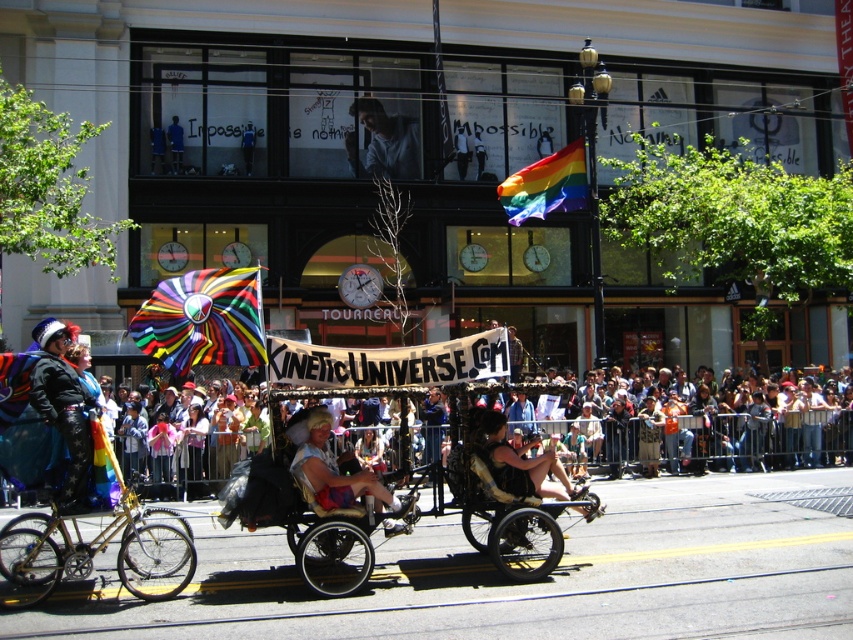
Question: Does shiny metallic bicycle at left lie behind leather jacket at center?

Choices:
 (A) no
 (B) yes

Answer: (A)

Question: Which point is closer to the camera?

Choices:
 (A) shiny metallic bicycle at left
 (B) blonde hair wig at center
 (C) metallic gold tricycle at center
 (D) leather jacket at center

Answer: (A)

Question: Does metallic gold tricycle at center have a lesser width compared to blonde hair wig at center?

Choices:
 (A) no
 (B) yes

Answer: (A)

Question: Based on their relative distances, which object is nearer to the shiny metallic bicycle at left?

Choices:
 (A) blonde hair wig at center
 (B) leather jacket at center
 (C) shiny metallic helmet at left
 (D) metallic gold tricycle at center

Answer: (C)

Question: Can you confirm if shiny metallic helmet at left is smaller than blonde hair wig at center?

Choices:
 (A) no
 (B) yes

Answer: (B)

Question: Which object appears farthest from the camera in this image?

Choices:
 (A) shiny metallic bicycle at left
 (B) metallic gold tricycle at center
 (C) leather jacket at center
 (D) shiny metallic helmet at left

Answer: (C)